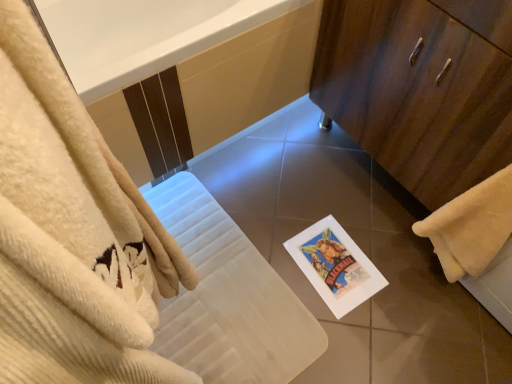
Question: Is white paper postcard at center positioned far away from wooden cabinet at right?

Choices:
 (A) no
 (B) yes

Answer: (A)

Question: Does white paper postcard at center have a larger size compared to wooden cabinet at right?

Choices:
 (A) yes
 (B) no

Answer: (B)

Question: Is white paper postcard at center looking in the opposite direction of wooden cabinet at right?

Choices:
 (A) no
 (B) yes

Answer: (A)

Question: Is white paper postcard at center next to wooden cabinet at right and touching it?

Choices:
 (A) yes
 (B) no

Answer: (B)

Question: Is white paper postcard at center wider than wooden cabinet at right?

Choices:
 (A) no
 (B) yes

Answer: (A)

Question: From a real-world perspective, is white paper postcard at center beneath wooden cabinet at right?

Choices:
 (A) yes
 (B) no

Answer: (A)

Question: From a real-world perspective, is white glossy bathtub at upper center on white paper postcard at center?

Choices:
 (A) yes
 (B) no

Answer: (A)

Question: Is the position of white glossy bathtub at upper center more distant than that of white paper postcard at center?

Choices:
 (A) no
 (B) yes

Answer: (A)

Question: Can you confirm if white glossy bathtub at upper center is bigger than white paper postcard at center?

Choices:
 (A) no
 (B) yes

Answer: (B)

Question: Does white glossy bathtub at upper center have a lesser height compared to white paper postcard at center?

Choices:
 (A) no
 (B) yes

Answer: (A)

Question: Can you see white glossy bathtub at upper center touching white paper postcard at center?

Choices:
 (A) no
 (B) yes

Answer: (A)

Question: From a real-world perspective, is white glossy bathtub at upper center positioned under white paper postcard at center based on gravity?

Choices:
 (A) no
 (B) yes

Answer: (A)

Question: Can you confirm if yellow fluffy towel at lower right is bigger than white glossy bathtub at upper center?

Choices:
 (A) yes
 (B) no

Answer: (B)